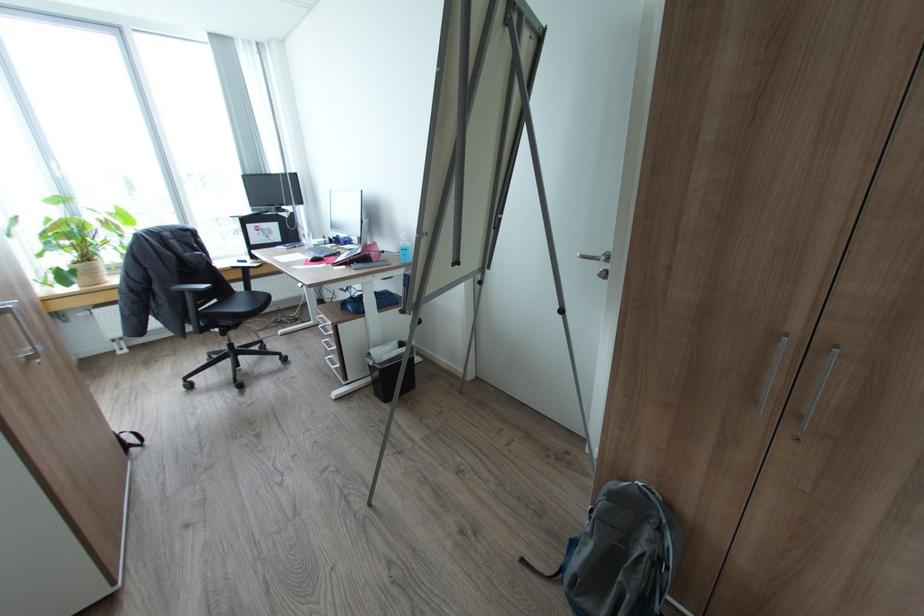
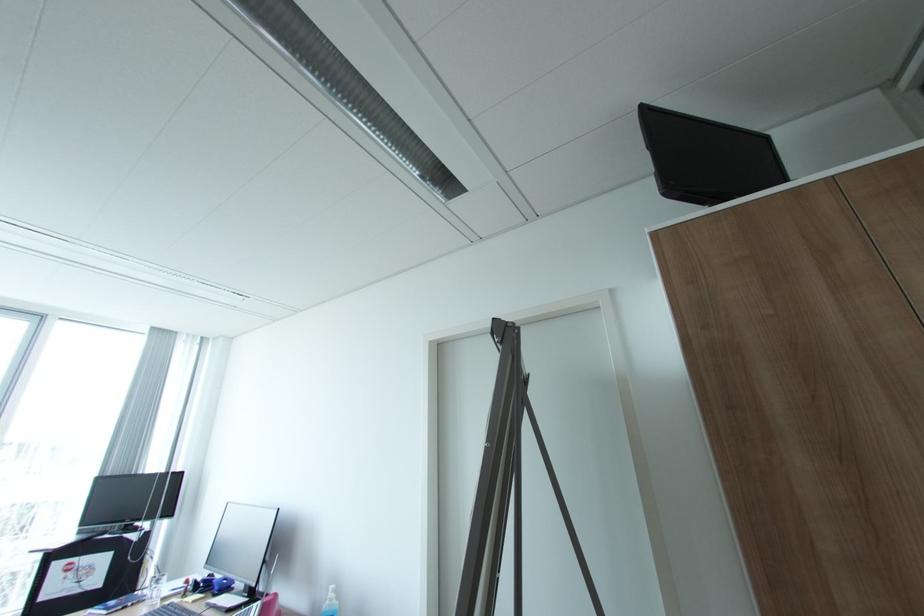
Based on the continuous images, in which direction is the camera rotating?

The camera rotated toward right-up.